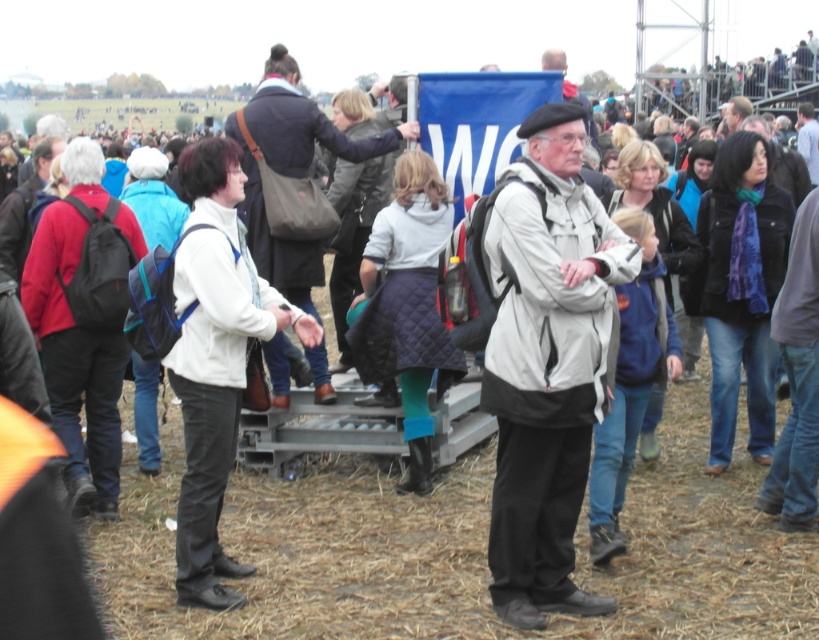
Which is more to the right, white quilted jacket at center or light gray jacket at center?

Positioned to the right is light gray jacket at center.

You are a GUI agent. You are given a task and a screenshot of the screen. Output one action in this format:
    pyautogui.click(x=<x>, y=<y>)
    Task: Click on the white quilted jacket at center
    
    Given the screenshot: What is the action you would take?
    pyautogui.click(x=292, y=173)

Can you confirm if white matte jacket at center is wider than light gray jacket at center?

No, white matte jacket at center is not wider than light gray jacket at center.

Between point (586, 593) and point (806, 154), which one is positioned behind?

Point (806, 154)

Locate an element on the screen. The height and width of the screenshot is (640, 819). white matte jacket at center is located at coordinates (546, 364).

Which of these two, white matte jacket at center or white quilted jacket at center, stands shorter?

Standing shorter between the two is white quilted jacket at center.

Measure the distance from white matte jacket at center to white quilted jacket at center.

A distance of 3.12 meters exists between white matte jacket at center and white quilted jacket at center.

Describe the element at coordinates (546, 364) in the screenshot. The height and width of the screenshot is (640, 819). I see `white matte jacket at center` at that location.

The width and height of the screenshot is (819, 640). I want to click on white matte jacket at center, so click(x=546, y=364).